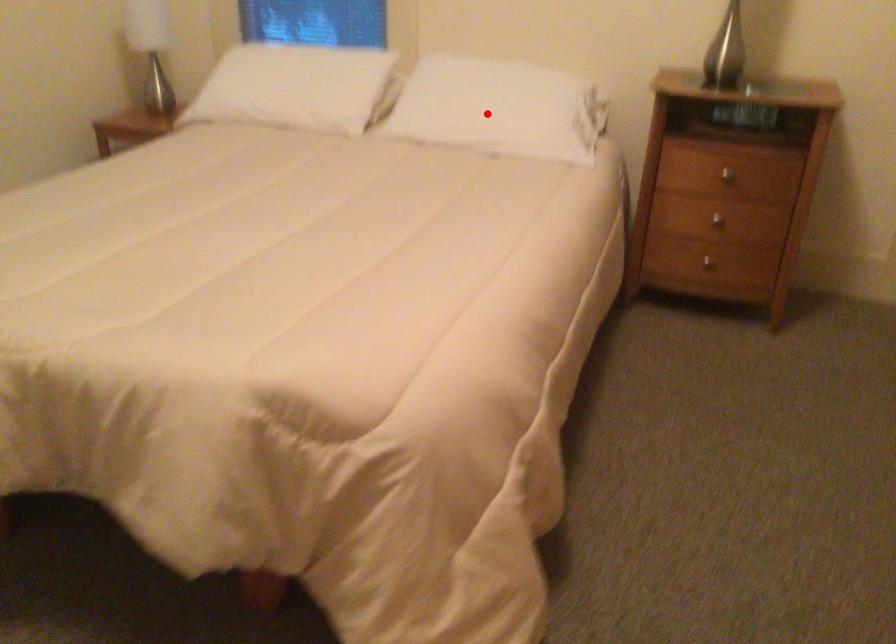
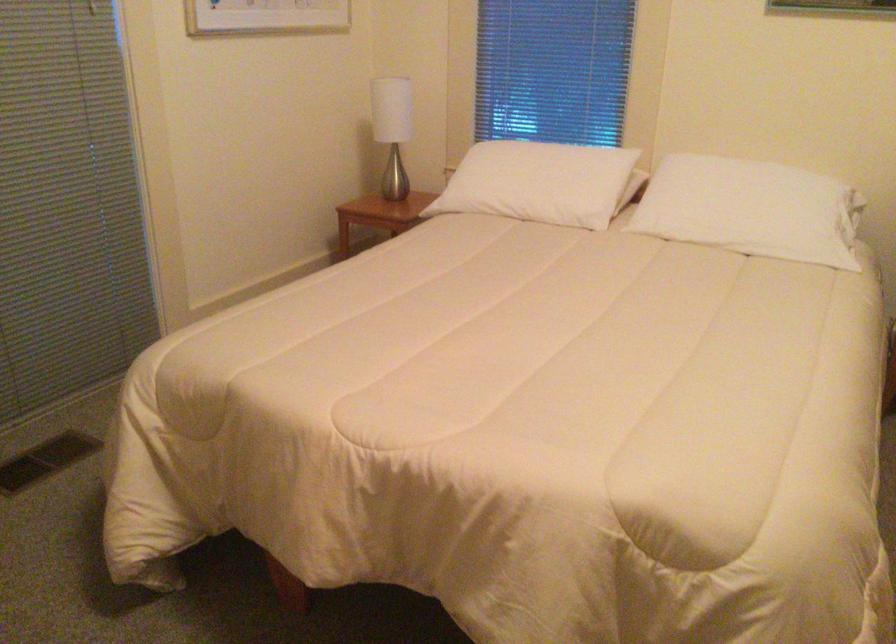
Find the pixel in the second image that matches the highlighted location in the first image.

(752, 210)